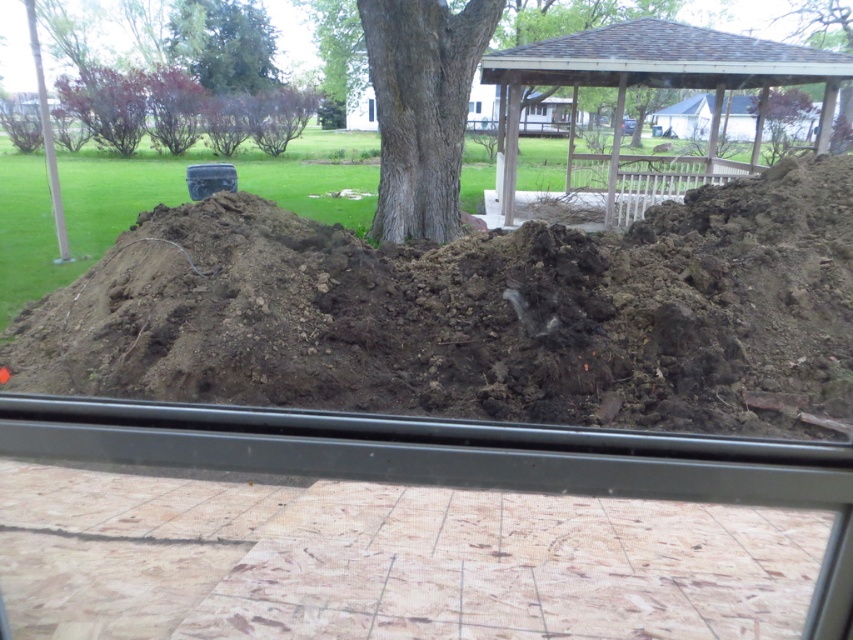
Which is more to the right, brown dirt at center or transparent glass window at center?

brown dirt at center

Between brown dirt at center and transparent glass window at center, which one appears on the left side from the viewer's perspective?

transparent glass window at center is more to the left.

Identify the location of brown dirt at center. (477, 314).

Is gray textured bark tree at center above green leafy tree at upper right?

Actually, gray textured bark tree at center is below green leafy tree at upper right.

Find the location of a particular element. gray textured bark tree at center is located at coordinates (421, 108).

Identify the location of gray textured bark tree at center. This screenshot has width=853, height=640. (421, 108).

Describe the element at coordinates (421, 108) in the screenshot. The height and width of the screenshot is (640, 853). I see `gray textured bark tree at center` at that location.

Does gray textured bark tree at center have a lesser height compared to transparent glass window at center?

No, gray textured bark tree at center is not shorter than transparent glass window at center.

Measure the distance between point (492, 28) and camera.

They are 28.58 feet apart.

This screenshot has width=853, height=640. Identify the location of gray textured bark tree at center. (421, 108).